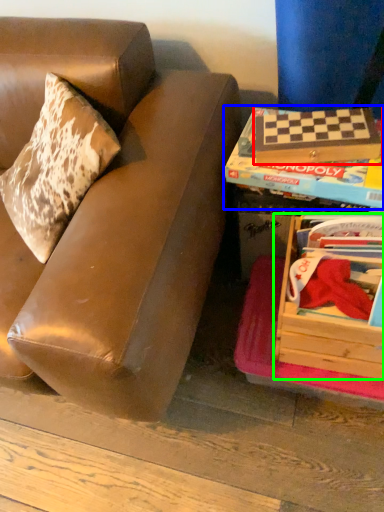
Question: Considering the real-world distances, which object is closest to paperback book (highlighted by a red box)? paperback book (highlighted by a blue box) or box (highlighted by a green box).

Choices:
 (A) paperback book
 (B) box

Answer: (A)